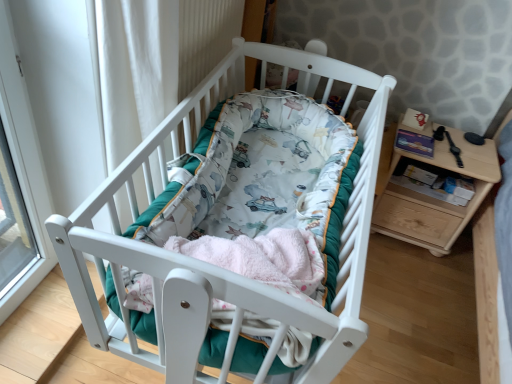
Question: From a real-world perspective, is black leather watch at right on top of white wood crib at center?

Choices:
 (A) no
 (B) yes

Answer: (A)

Question: Can you confirm if black leather watch at right is shorter than white wood crib at center?

Choices:
 (A) yes
 (B) no

Answer: (A)

Question: From the image's perspective, would you say black leather watch at right is positioned over white wood crib at center?

Choices:
 (A) no
 (B) yes

Answer: (B)

Question: Considering the relative sizes of black leather watch at right and white wood crib at center in the image provided, is black leather watch at right smaller than white wood crib at center?

Choices:
 (A) yes
 (B) no

Answer: (A)

Question: Does black leather watch at right have a greater height compared to white wood crib at center?

Choices:
 (A) yes
 (B) no

Answer: (B)

Question: Is black leather watch at right wider or thinner than white wood crib at center?

Choices:
 (A) wide
 (B) thin

Answer: (B)

Question: Is black leather watch at right inside or outside of white wood crib at center?

Choices:
 (A) inside
 (B) outside

Answer: (B)

Question: In terms of height, does black leather watch at right look taller or shorter compared to white wood crib at center?

Choices:
 (A) short
 (B) tall

Answer: (A)

Question: From a real-world perspective, is black leather watch at right above or below white wood crib at center?

Choices:
 (A) above
 (B) below

Answer: (B)

Question: Does point (297, 322) appear closer or farther from the camera than point (281, 228)?

Choices:
 (A) farther
 (B) closer

Answer: (B)

Question: Is white wood crib at center situated inside fluffy pink blanket at center or outside?

Choices:
 (A) inside
 (B) outside

Answer: (B)

Question: Looking at the image, does white wood crib at center seem bigger or smaller compared to fluffy pink blanket at center?

Choices:
 (A) small
 (B) big

Answer: (B)

Question: In terms of height, does white wood crib at center look taller or shorter compared to fluffy pink blanket at center?

Choices:
 (A) tall
 (B) short

Answer: (A)

Question: From their relative heights in the image, would you say wooden changing table at right is taller or shorter than white wood crib at center?

Choices:
 (A) short
 (B) tall

Answer: (B)

Question: Looking at the image, does wooden changing table at right seem bigger or smaller compared to white wood crib at center?

Choices:
 (A) big
 (B) small

Answer: (B)